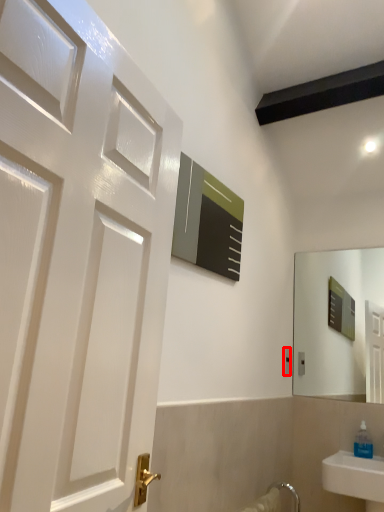
Question: From the image's perspective, where is electric outlet (annotated by the red box) located relative to soap dispenser?

Choices:
 (A) above
 (B) below

Answer: (A)